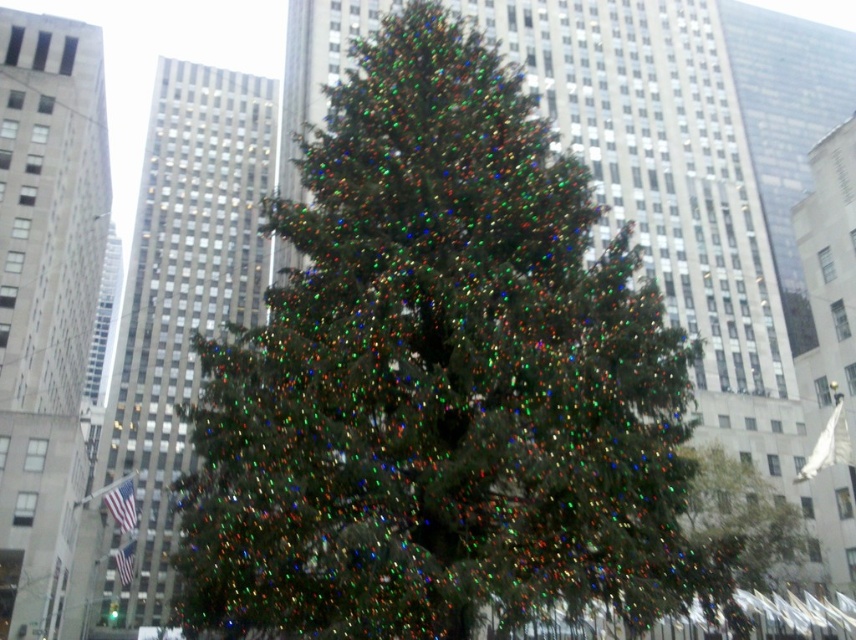
You are a city planner assessing the space for a new holiday display. You notice two trees labeled as the iridescent green pine tree at center and the green matte tree at center. Based on their height, which tree would require more vertical clearance for installation?

The iridescent green pine tree at center requires more vertical clearance because it has a greater height compared to the green matte tree at center.

You are a city planner reviewing the Christmas decorations. You notice two trees labeled as the iridescent green pine tree at center and the green matte tree at center. According to the scene description, which tree is located to the left of the other?

The iridescent green pine tree at center is positioned on the left side of green matte tree at center.

You are standing in the city plaza and see the iridescent green pine tree at center and the green matte tree at center. Which tree is closer to you?

The iridescent green pine tree at center is closer to you because it is in front of the green matte tree at center.